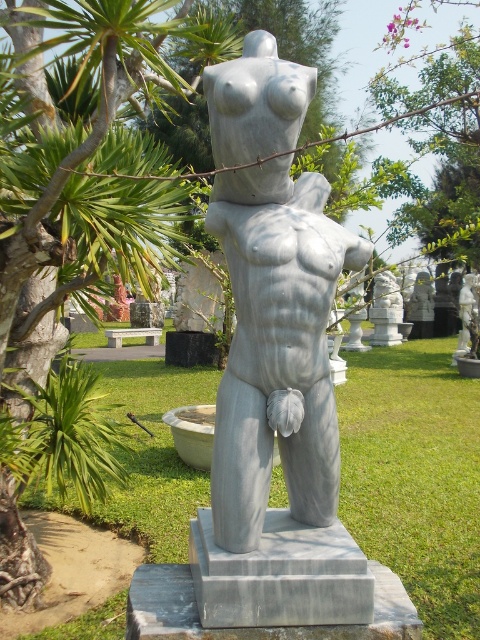
Question: Considering the relative positions of green leafy tree at left and white marble statue at center in the image provided, where is green leafy tree at left located with respect to white marble statue at center?

Choices:
 (A) left
 (B) right

Answer: (A)

Question: Observing the image, what is the correct spatial positioning of green leafy tree at left in reference to white marble statue at center?

Choices:
 (A) right
 (B) left

Answer: (B)

Question: Among these objects, which one is farthest from the camera?

Choices:
 (A) green leafy tree at left
 (B) white marble statue at center

Answer: (A)

Question: Does green leafy tree at left come behind white marble statue at center?

Choices:
 (A) no
 (B) yes

Answer: (B)